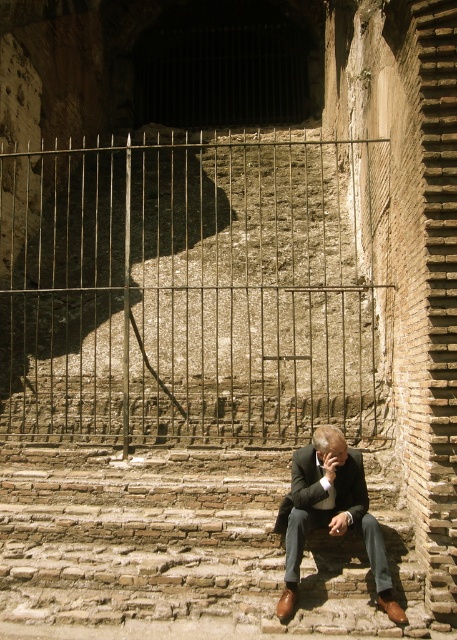
Between rusty metal gate at center and dark brown leather suit at lower center, which one is positioned higher?

Positioned higher is rusty metal gate at center.

Is rusty metal gate at center above dark brown leather suit at lower center?

Indeed, rusty metal gate at center is positioned over dark brown leather suit at lower center.

This screenshot has width=457, height=640. I want to click on rusty metal gate at center, so click(190, 289).